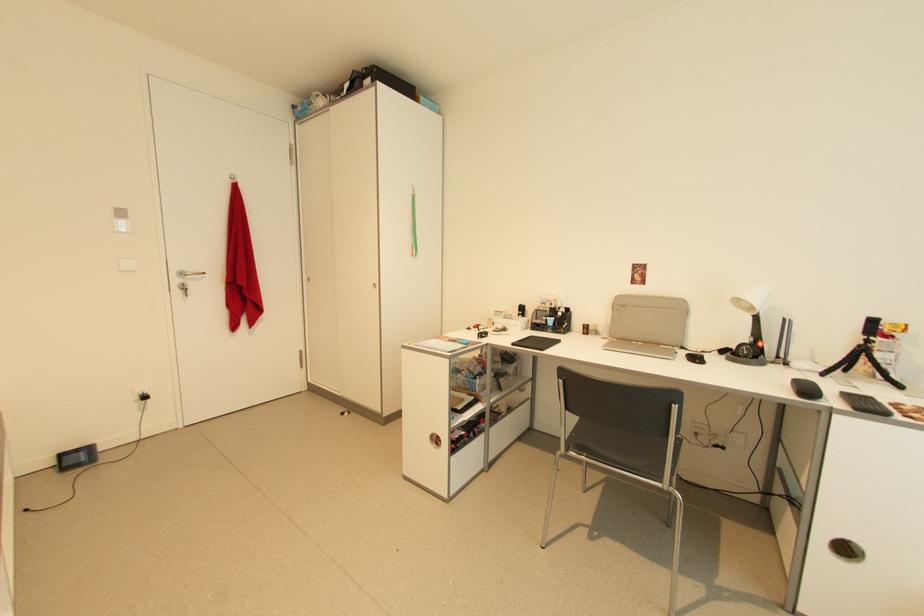
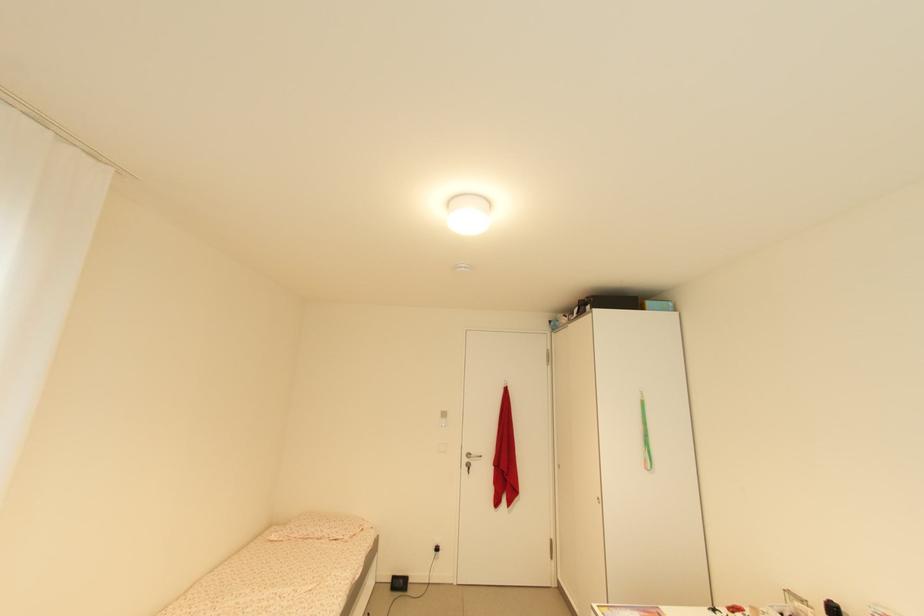
Find the pixel in the second image that matches the point at 372,70 in the first image.

(592, 299)